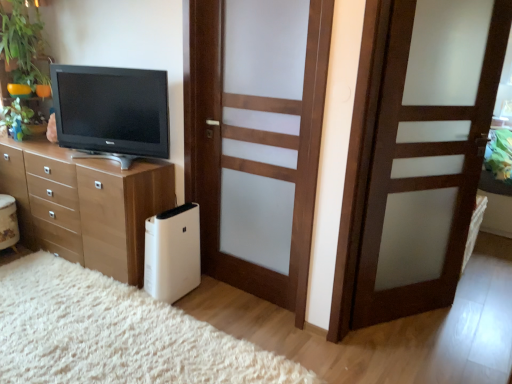
Question: Visually, is wooden door at center, the 2th door when ordered from left to right, positioned to the left or to the right of matte black tv at left?

Choices:
 (A) left
 (B) right

Answer: (B)

Question: Do you think wooden door at center, the 2th door when ordered from left to right, is within matte black tv at left, or outside of it?

Choices:
 (A) outside
 (B) inside

Answer: (A)

Question: Considering the real-world distances, which object is farthest from the wooden door with frosted glass at center, marked as the first door in a left-to-right arrangement?

Choices:
 (A) light wood chest of drawers at left
 (B) white matte air purifier at lower left
 (C) white plastic air purifier at lower center
 (D) green glossy plant at upper left, placed as the 1th plant when sorted from bottom to top
 (E) wooden door at center, acting as the first door starting from the right

Answer: (D)

Question: Which object is positioned farthest from the green glossy plant at upper left, the 2th plant in the top-to-bottom sequence?

Choices:
 (A) wooden door at center, acting as the first door starting from the right
 (B) light wood chest of drawers at left
 (C) white plastic air purifier at lower center
 (D) white matte air purifier at lower left
 (E) wooden door with frosted glass at center, marked as the first door in a left-to-right arrangement

Answer: (A)